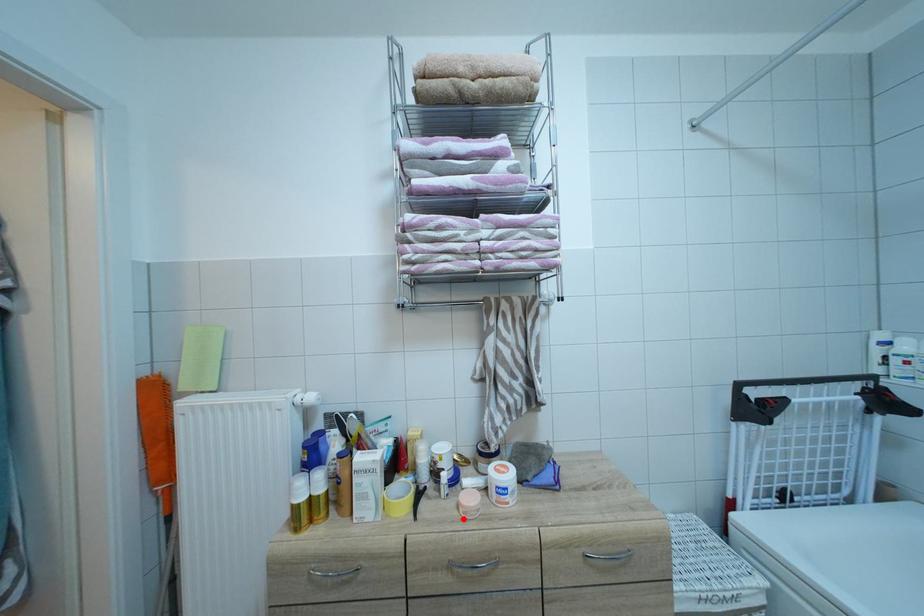
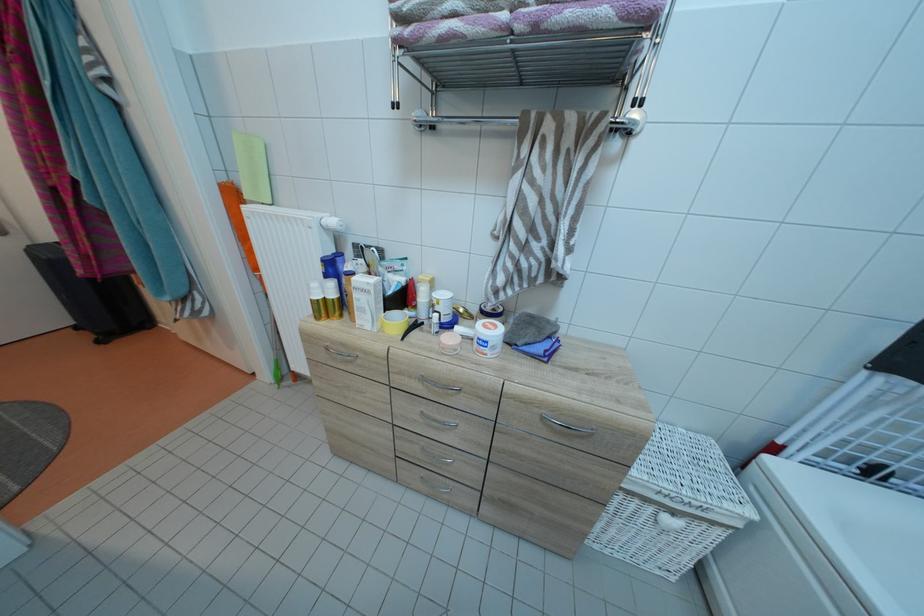
In the second image, find the point that corresponds to the highlighted location in the first image.

(444, 352)